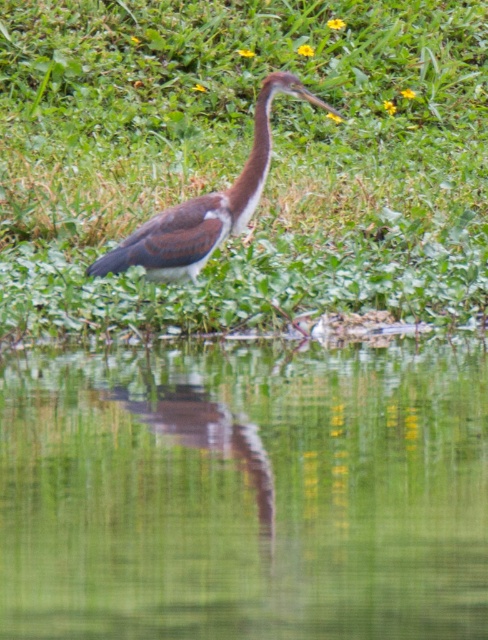
Question: Can you confirm if green reflective water at center is smaller than brown matte neck at upper center?

Choices:
 (A) yes
 (B) no

Answer: (B)

Question: Which point is farther to the camera?

Choices:
 (A) brown feathered bird at center
 (B) green leafy grass at center

Answer: (B)

Question: Is green leafy grass at center positioned behind green reflective water at center?

Choices:
 (A) no
 (B) yes

Answer: (B)

Question: Is brown feathered bird at center bigger than brown matte neck at upper center?

Choices:
 (A) yes
 (B) no

Answer: (A)

Question: Which point is closer to the camera?

Choices:
 (A) (192, 253)
 (B) (472, 264)
 (C) (260, 150)

Answer: (C)

Question: Which object is positioned closest to the green leafy grass at center?

Choices:
 (A) brown matte neck at upper center
 (B) green reflective water at center

Answer: (A)